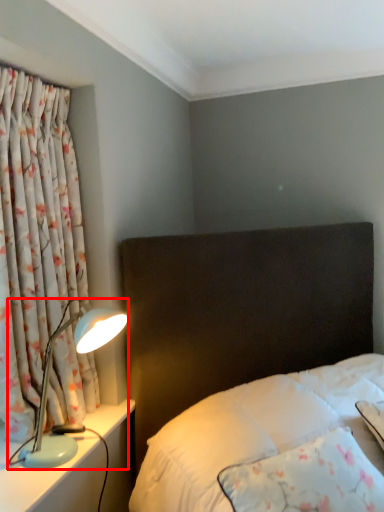
Question: From the image's perspective, what is the correct spatial positioning of lamp (annotated by the red box) in reference to curtain?

Choices:
 (A) below
 (B) above

Answer: (A)